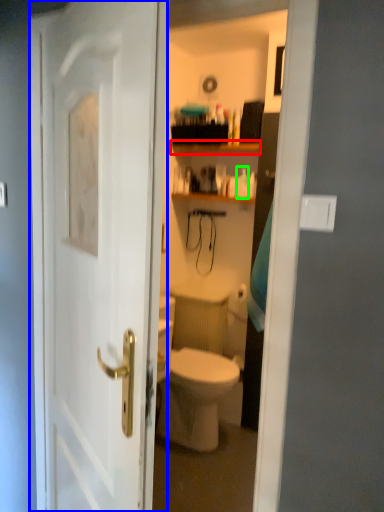
Question: Based on their relative distances, which object is farther from shelf (highlighted by a red box)? Choose from door (highlighted by a blue box) and toiletry (highlighted by a green box).

Choices:
 (A) door
 (B) toiletry

Answer: (A)